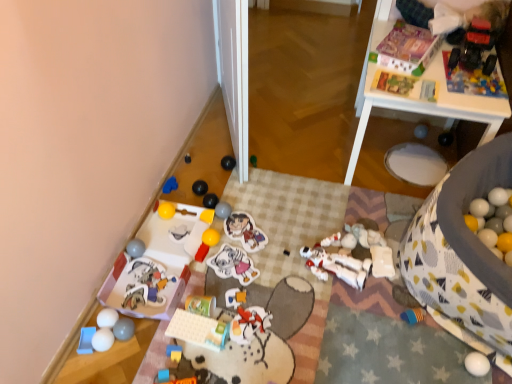
You are a GUI agent. You are given a task and a screenshot of the screen. Output one action in this format:
    pyautogui.click(x=<x>, y=<y>)
    Task: Click on the empty space that is in between yellow rubber ball at center, which ranks as the eleventh toy in right-to-left order, and white matte doll at center, acting as the 22th toy starting from the left
    This screenshot has width=512, height=384.
    Given the screenshot: What is the action you would take?
    pyautogui.click(x=266, y=253)